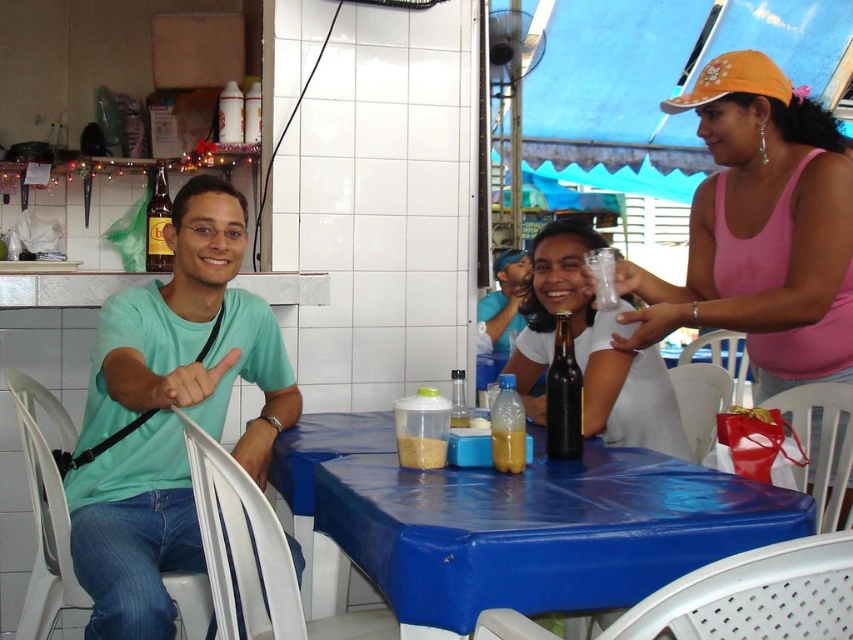
Describe the element at coordinates (563, 396) in the screenshot. I see `brown glass bottle at table center` at that location.

Between point (570, 388) and point (399, 465), which one is positioned behind?

Point (570, 388)

Identify the location of brown glass bottle at table center. (563, 396).

From the picture: Could you measure the distance between brown glass bottle at upper left and translucent plastic container at table center?

1.08 meters

The height and width of the screenshot is (640, 853). I want to click on brown glass bottle at upper left, so click(x=157, y=225).

Who is lower down, pink fabric tank top at upper right or translucent plastic cup at table center?

translucent plastic cup at table center is below.

Who is taller, pink fabric tank top at upper right or translucent plastic cup at table center?

Standing taller between the two is pink fabric tank top at upper right.

Between point (738, 211) and point (454, 403), which one is positioned in front?

Positioned in front is point (454, 403).

The height and width of the screenshot is (640, 853). I want to click on pink fabric tank top at upper right, so click(x=761, y=228).